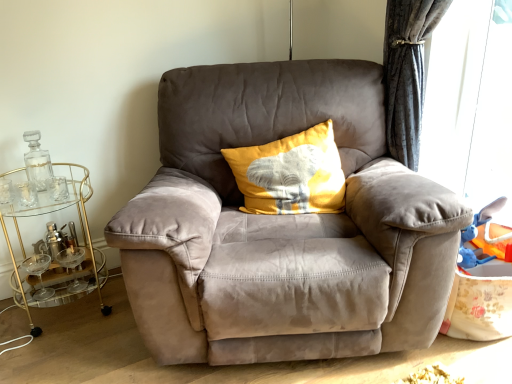
Question: Is yellow fabric pillow at center shorter than clear glass bottle at left?

Choices:
 (A) yes
 (B) no

Answer: (B)

Question: Is the surface of yellow fabric pillow at center in direct contact with clear glass bottle at left?

Choices:
 (A) yes
 (B) no

Answer: (B)

Question: Considering the relative sizes of yellow fabric pillow at center and clear glass bottle at left in the image provided, is yellow fabric pillow at center bigger than clear glass bottle at left?

Choices:
 (A) yes
 (B) no

Answer: (A)

Question: Does yellow fabric pillow at center appear on the left side of clear glass bottle at left?

Choices:
 (A) no
 (B) yes

Answer: (A)

Question: From the image's perspective, does yellow fabric pillow at center appear lower than clear glass bottle at left?

Choices:
 (A) no
 (B) yes

Answer: (A)

Question: Is point (257, 205) positioned closer to the camera than point (431, 41)?

Choices:
 (A) closer
 (B) farther

Answer: (A)

Question: Looking at their shapes, would you say yellow fabric pillow at center is wider or thinner than transparent plastic window screen at right?

Choices:
 (A) thin
 (B) wide

Answer: (B)

Question: Choose the correct answer: Is yellow fabric pillow at center inside transparent plastic window screen at right or outside it?

Choices:
 (A) outside
 (B) inside

Answer: (A)

Question: From a real-world perspective, is yellow fabric pillow at center positioned above or below transparent plastic window screen at right?

Choices:
 (A) above
 (B) below

Answer: (B)

Question: From the image's perspective, is transparent plastic window screen at right positioned above or below suede gray armchair at center?

Choices:
 (A) below
 (B) above

Answer: (B)

Question: From a real-world perspective, is transparent plastic window screen at right above or below suede gray armchair at center?

Choices:
 (A) below
 (B) above

Answer: (B)

Question: Which is correct: transparent plastic window screen at right is inside suede gray armchair at center, or outside of it?

Choices:
 (A) inside
 (B) outside

Answer: (B)

Question: In terms of size, does transparent plastic window screen at right appear bigger or smaller than suede gray armchair at center?

Choices:
 (A) small
 (B) big

Answer: (A)

Question: From the image's perspective, is yellow fabric pillow at center above or below clear glass bottle at left?

Choices:
 (A) below
 (B) above

Answer: (B)

Question: Considering the positions of point (263, 188) and point (39, 155), is point (263, 188) closer or farther from the camera than point (39, 155)?

Choices:
 (A) farther
 (B) closer

Answer: (B)